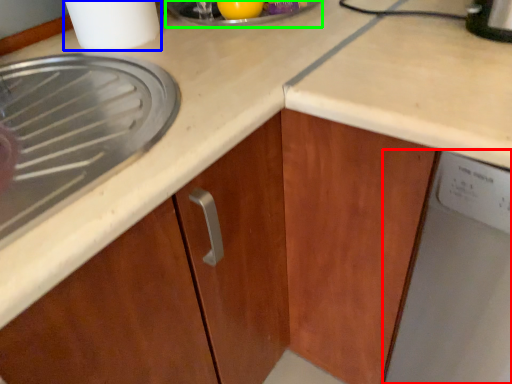
Question: Which object is positioned closest to home appliance (highlighted by a red box)? Select from kitchen appliance (highlighted by a blue box) and appliance (highlighted by a green box).

Choices:
 (A) kitchen appliance
 (B) appliance

Answer: (B)